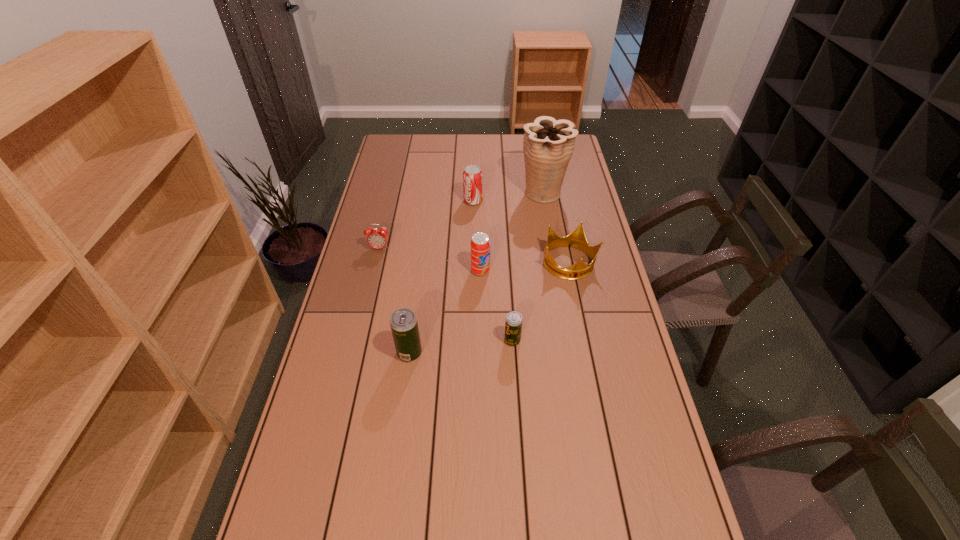
The image size is (960, 540). What are the coordinates of `vacant space located on the right of the shorter beer can` in the screenshot? It's located at (607, 341).

Image resolution: width=960 pixels, height=540 pixels. I want to click on vacant space situated 0.100m on the logo side of the farther soda can, so click(507, 201).

Image resolution: width=960 pixels, height=540 pixels. I want to click on vacant space located on the left of the tallest object, so click(465, 192).

Locate an element on the screen. The image size is (960, 540). vacant space situated 0.140m on the right of the nearer soda can is located at coordinates (530, 271).

You are a GUI agent. You are given a task and a screenshot of the screen. Output one action in this format:
    pyautogui.click(x=<x>, y=<y>)
    Task: Click on the vacant space located on the face of the leftmost object
    This screenshot has width=960, height=540.
    Given the screenshot: What is the action you would take?
    pyautogui.click(x=365, y=311)

Where is `vacant space located on the front of the crown`? This screenshot has height=540, width=960. vacant space located on the front of the crown is located at coordinates (585, 339).

Locate an element on the screen. This screenshot has width=960, height=540. object that is at the left edge is located at coordinates (377, 238).

The width and height of the screenshot is (960, 540). I want to click on urn at the right edge, so click(x=548, y=145).

Where is `crown present at the right edge`? Image resolution: width=960 pixels, height=540 pixels. crown present at the right edge is located at coordinates (576, 239).

This screenshot has height=540, width=960. In order to click on free space at the far edge in this screenshot , I will do `click(452, 144)`.